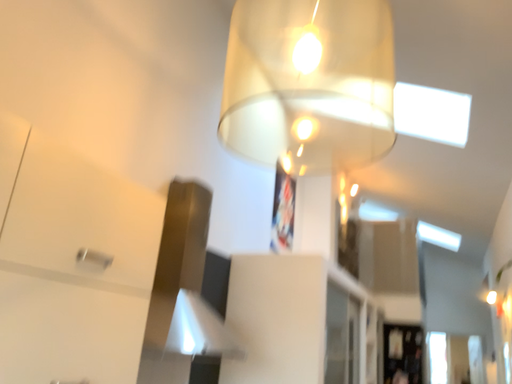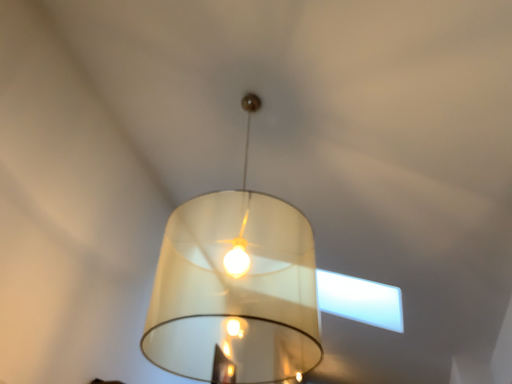
Question: How did the camera likely rotate when shooting the video?

Choices:
 (A) rotated upward
 (B) rotated downward

Answer: (A)